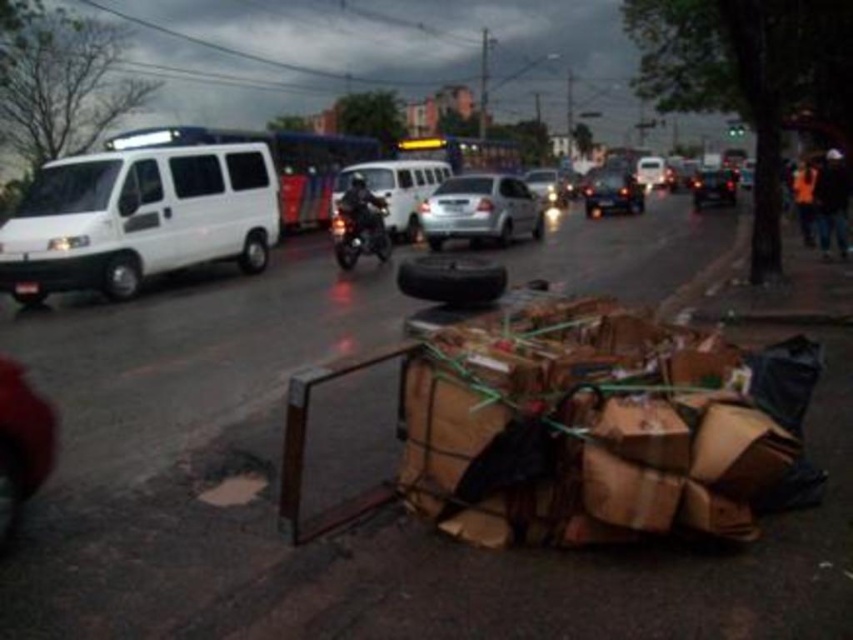
Question: Estimate the real-world distances between objects in this image. Which object is closer to the silver metallic car at center?

Choices:
 (A) shiny metallic motorcycle at center
 (B) white matte van at left
 (C) dark matte motorcycle at center

Answer: (C)

Question: Which object is farther from the camera taking this photo?

Choices:
 (A) metallic silver car at center
 (B) white matte van at left
 (C) white matte van at center
 (D) metallic silver sedan at center

Answer: (D)

Question: Does shiny metallic motorcycle at center have a lesser width compared to shiny black car at center?

Choices:
 (A) yes
 (B) no

Answer: (A)

Question: Estimate the real-world distances between objects in this image. Which object is farther from the white matte van at center?

Choices:
 (A) white matte van at left
 (B) metallic silver sedan at center

Answer: (B)

Question: Does shiny metallic motorcycle at center have a larger size compared to dark matte motorcycle at center?

Choices:
 (A) no
 (B) yes

Answer: (B)

Question: Can you confirm if white matte van at left is positioned above dark matte motorcycle at center?

Choices:
 (A) no
 (B) yes

Answer: (A)